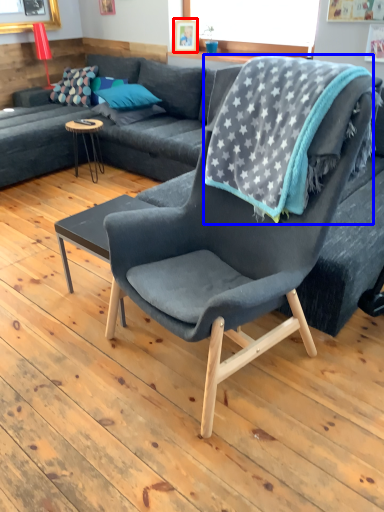
Question: Which object appears closest to the camera in this image, picture frame (highlighted by a red box) or blanket (highlighted by a blue box)?

Choices:
 (A) picture frame
 (B) blanket

Answer: (B)